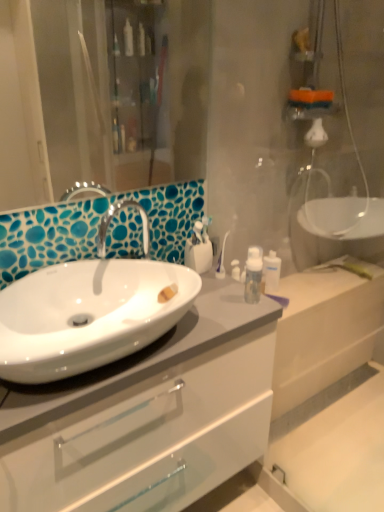
At what (x,y) coordinates should I click in order to perform the action: click on unoccupied region to the right of transparent plastic bottle at upper right, the second toiletry viewed from the left. Please return your answer as a coordinate pair (x, y). The image size is (384, 512). Looking at the image, I should click on (307, 289).